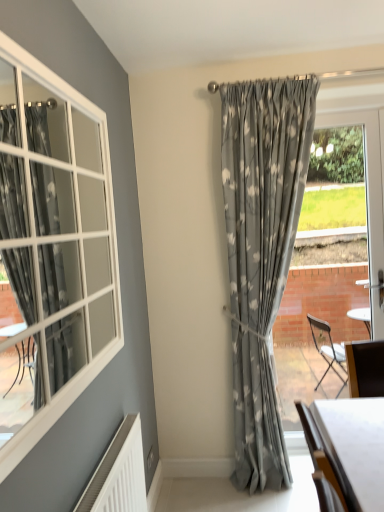
Question: Is white glossy table at lower right positioned with its back to clear glass door at right?

Choices:
 (A) no
 (B) yes

Answer: (A)

Question: Can you confirm if white glossy table at lower right is positioned to the left of clear glass door at right?

Choices:
 (A) no
 (B) yes

Answer: (B)

Question: Is white glossy table at lower right to the right of clear glass door at right from the viewer's perspective?

Choices:
 (A) no
 (B) yes

Answer: (A)

Question: Can you confirm if white glossy table at lower right is bigger than clear glass door at right?

Choices:
 (A) no
 (B) yes

Answer: (A)

Question: From the image's perspective, is white glossy table at lower right located beneath clear glass door at right?

Choices:
 (A) yes
 (B) no

Answer: (A)

Question: From a real-world perspective, relative to clear glass door at right, is matte gray curtain at center vertically above or below?

Choices:
 (A) above
 (B) below

Answer: (A)

Question: Is matte gray curtain at center spatially inside clear glass door at right, or outside of it?

Choices:
 (A) inside
 (B) outside

Answer: (B)

Question: Is matte gray curtain at center taller or shorter than clear glass door at right?

Choices:
 (A) short
 (B) tall

Answer: (B)

Question: Is point (248, 460) positioned closer to the camera than point (304, 245)?

Choices:
 (A) farther
 (B) closer

Answer: (B)

Question: Is point (311, 390) positioned closer to the camera than point (248, 219)?

Choices:
 (A) farther
 (B) closer

Answer: (A)

Question: From their relative heights in the image, would you say clear glass door at right is taller or shorter than matte gray curtain at center?

Choices:
 (A) short
 (B) tall

Answer: (A)

Question: Is clear glass door at right spatially inside matte gray curtain at center, or outside of it?

Choices:
 (A) outside
 (B) inside

Answer: (A)

Question: From the image's perspective, relative to matte gray curtain at center, is clear glass door at right above or below?

Choices:
 (A) above
 (B) below

Answer: (A)

Question: Would you say clear glass door at right is inside or outside white glossy table at lower right?

Choices:
 (A) outside
 (B) inside

Answer: (A)

Question: Would you say clear glass door at right is to the left or to the right of white glossy table at lower right in the picture?

Choices:
 (A) right
 (B) left

Answer: (A)